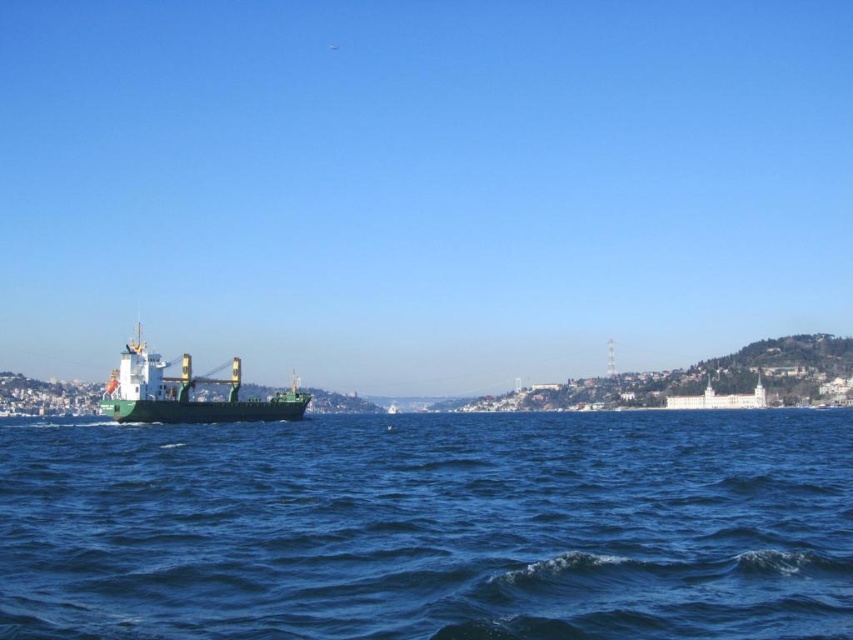
You are a sailor trying to navigate from the green matte cargo ship at center to the nearest dock. The blue water at center is calmer than the surrounding areas. Which direction should you steer your ship to ensure a smooth journey?

The blue water at center has a larger size compared to green matte cargo ship at center, so steering towards the blue water at center would provide a smoother path as it is calmer and has more space.